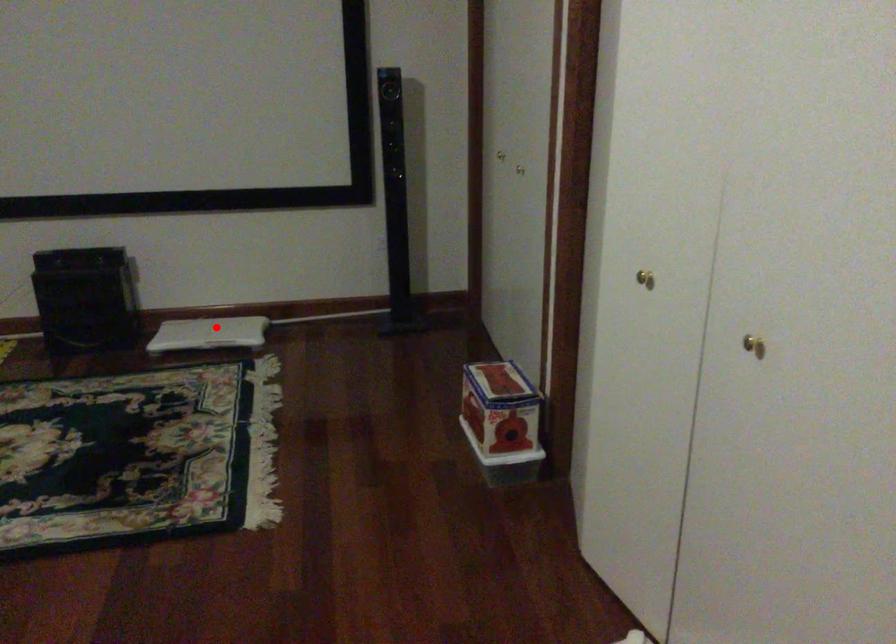
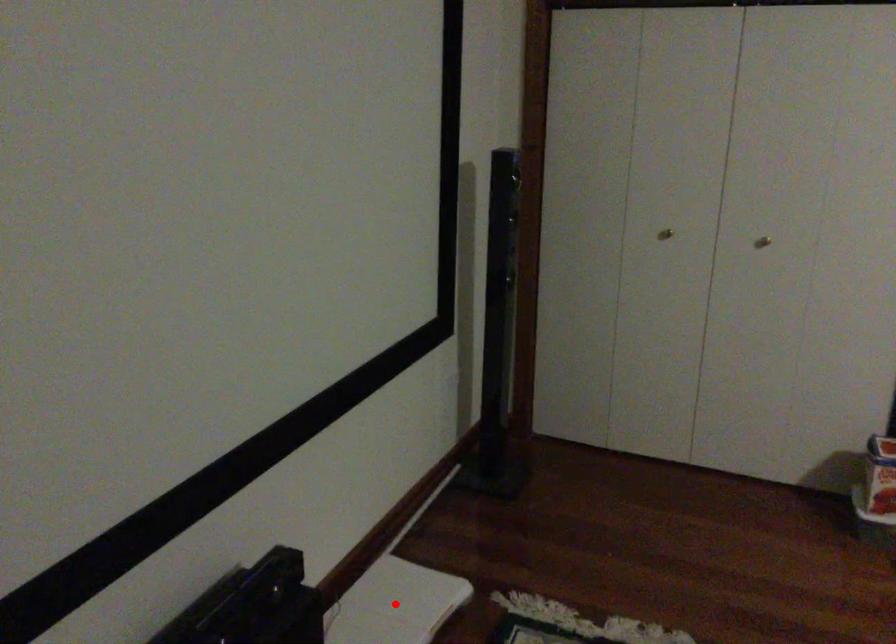
I am providing you with two images of the same scene from different viewpoints. A red point is marked on the first image and another point is marked on the second image. Does the point marked in image1 correspond to the same location as the one in image2?

Yes